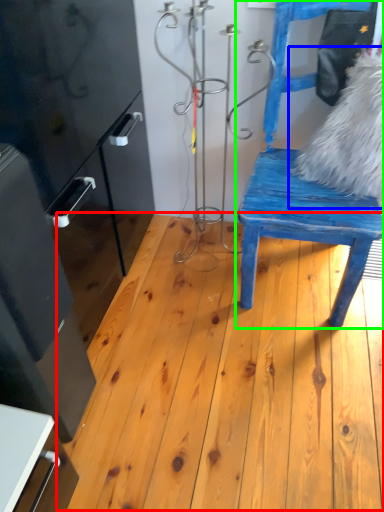
Question: Which object is positioned closest to hardwood (highlighted by a red box)? Select from animal (highlighted by a blue box) and chair (highlighted by a green box).

Choices:
 (A) animal
 (B) chair

Answer: (B)